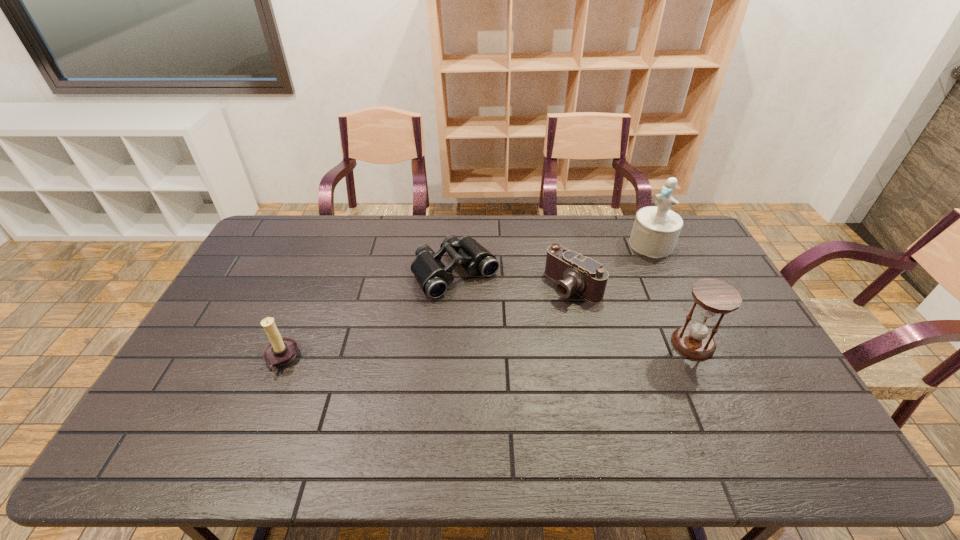
Locate an element on the screen. The width and height of the screenshot is (960, 540). vacant spot on the desktop that is between the third shortest object and the hourglass and is positioned on the front-facing side of the third object from left to right is located at coordinates (491, 352).

Image resolution: width=960 pixels, height=540 pixels. I want to click on vacant spot on the desktop that is between the third tallest object and the fourth shortest object and is positioned at the beak of the tallest object, so click(x=522, y=350).

I want to click on free space on the desktop that is between the leftmost object and the hourglass and is positioned on the front-facing side of the second object from left to right, so (x=523, y=350).